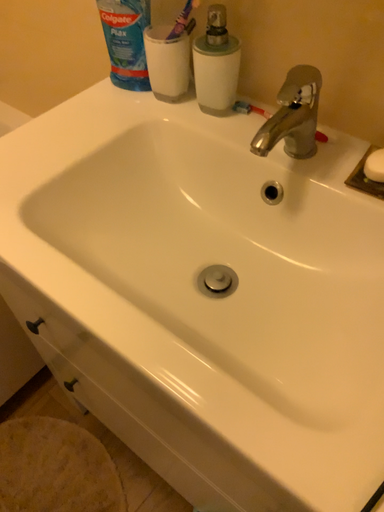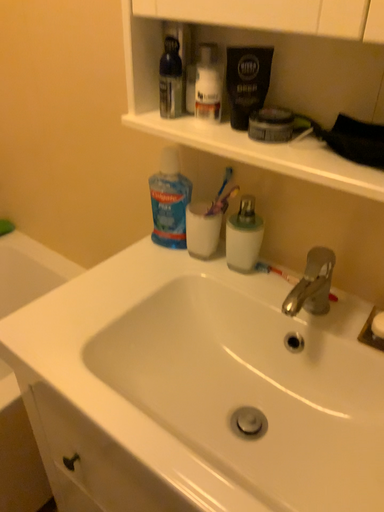
Question: Which way did the camera rotate in the video?

Choices:
 (A) rotated upward
 (B) rotated downward

Answer: (A)